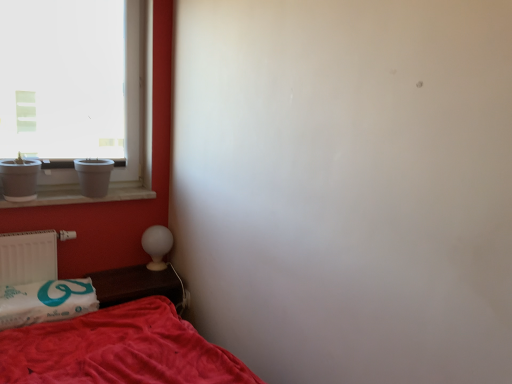
In order to click on free space above brown wooden table at lower left (from a real-world perspective) in this screenshot , I will do `click(134, 283)`.